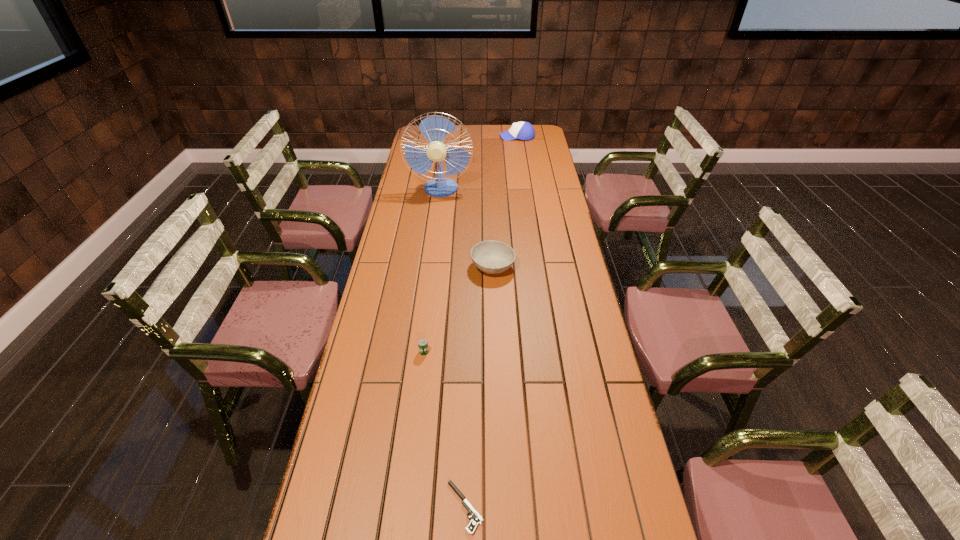
Find the location of a particular element. object at the left edge is located at coordinates (434, 128).

What are the coordinates of `object situated at the right edge` in the screenshot? It's located at (522, 130).

I want to click on object situated at the far right corner, so click(x=522, y=130).

Where is `vacant area at the far edge`? The image size is (960, 540). vacant area at the far edge is located at coordinates pos(508,143).

Locate an element on the screen. Image resolution: width=960 pixels, height=540 pixels. vacant area at the left edge is located at coordinates (425, 228).

Identify the location of free spot at the right edge of the desktop. (539, 221).

Where is `vacant space at the far right corner of the desktop`? This screenshot has width=960, height=540. vacant space at the far right corner of the desktop is located at coordinates (544, 129).

Find the location of `free space that is in between the fourth nearest object and the baseball cap`. free space that is in between the fourth nearest object and the baseball cap is located at coordinates 479,163.

Locate an element on the screen. This screenshot has height=540, width=960. free point between the bowl and the tallest object is located at coordinates (467, 228).

This screenshot has height=540, width=960. What are the coordinates of `blank region between the pistol and the bowl` in the screenshot? It's located at tap(479, 387).